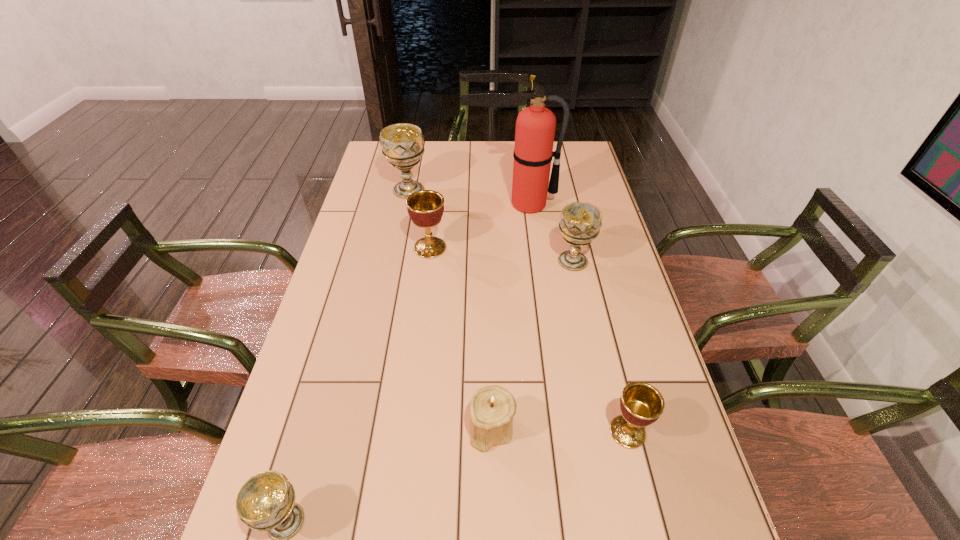
Locate an element on the screen. The width and height of the screenshot is (960, 540). the smaller golden chalice is located at coordinates tap(641, 404).

You are a GUI agent. You are given a task and a screenshot of the screen. Output one action in this format:
    pyautogui.click(x=<x>, y=<y>)
    Task: Click on the nearer golden chalice
    The height and width of the screenshot is (540, 960).
    Given the screenshot: What is the action you would take?
    pyautogui.click(x=641, y=404)

Locate an element on the screen. free space located 0.160m at the nozzle of the fire extinguisher is located at coordinates (536, 246).

Find the location of a particular element. This screenshot has width=960, height=540. vacant area located on the back of the tallest chalice is located at coordinates (416, 156).

Where is `vacant area located 0.110m on the back of the left golden chalice`? The width and height of the screenshot is (960, 540). vacant area located 0.110m on the back of the left golden chalice is located at coordinates coord(434,215).

Locate an element on the screen. The width and height of the screenshot is (960, 540). vacant region located on the left of the second farthest white chalice is located at coordinates (534, 261).

I want to click on vacant region located on the back of the beige candle_holder, so click(x=491, y=375).

At what (x,y) coordinates should I click in order to perform the action: click on vacant space located 0.080m on the front of the nearer golden chalice. Please return your answer as a coordinate pair (x, y). Looking at the image, I should click on (642, 490).

Where is `object present at the left edge`? object present at the left edge is located at coordinates (402, 144).

In the image, there is a desktop. In order to click on vacant space at the far edge in this screenshot , I will do `click(463, 154)`.